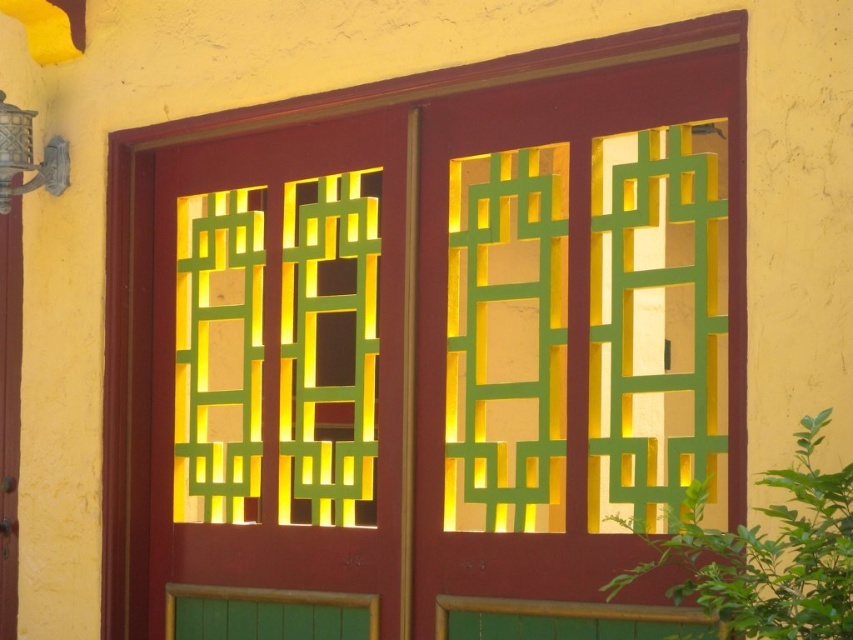
Can you confirm if matte wood screen door at center is wider than metallic wall sconce at upper left?

Correct, the width of matte wood screen door at center exceeds that of metallic wall sconce at upper left.

Does point (648, 211) come behind point (51, 141)?

No, (648, 211) is closer to viewer.

The image size is (853, 640). In order to click on matte wood screen door at center in this screenshot , I will do `click(427, 333)`.

Find the location of a particular element. The image size is (853, 640). matte wood screen door at center is located at coordinates (427, 333).